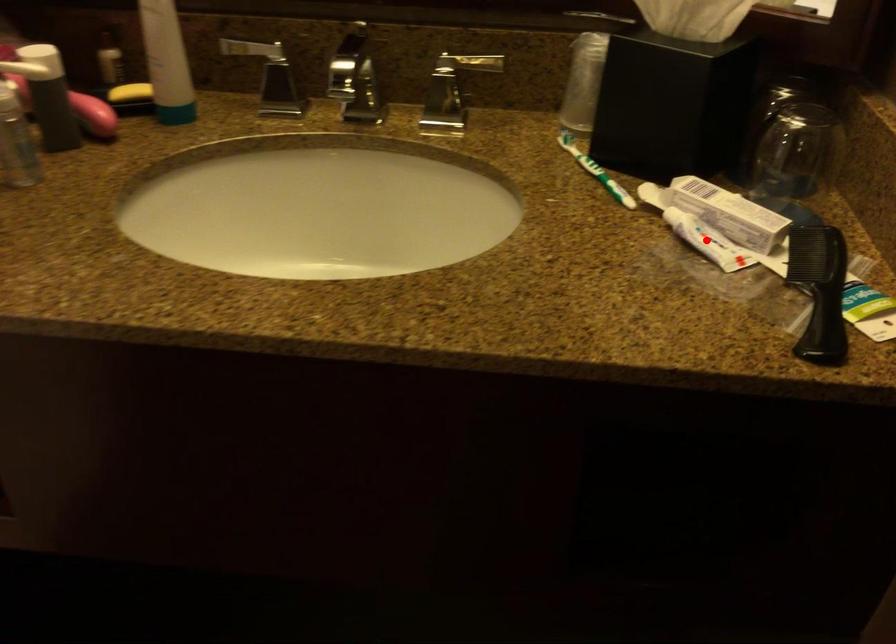
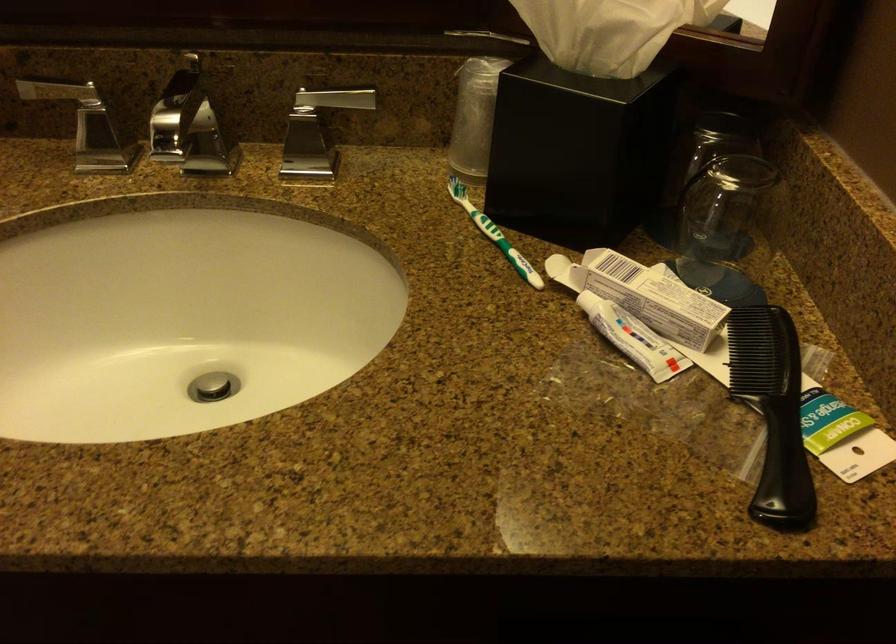
Where in the second image is the point corresponding to the highlighted location from the first image?

(633, 337)